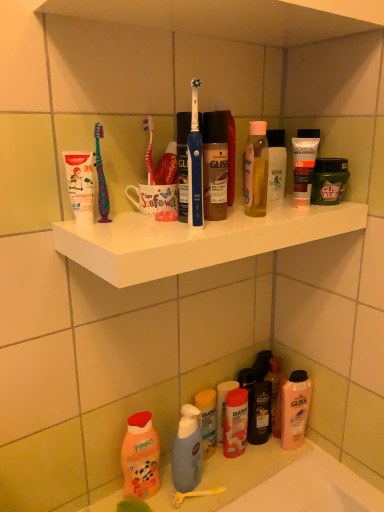
This screenshot has width=384, height=512. I want to click on free space in front of white matte toothpaste tube at upper left, positioned as the third toiletry in top-to-bottom order, so click(100, 234).